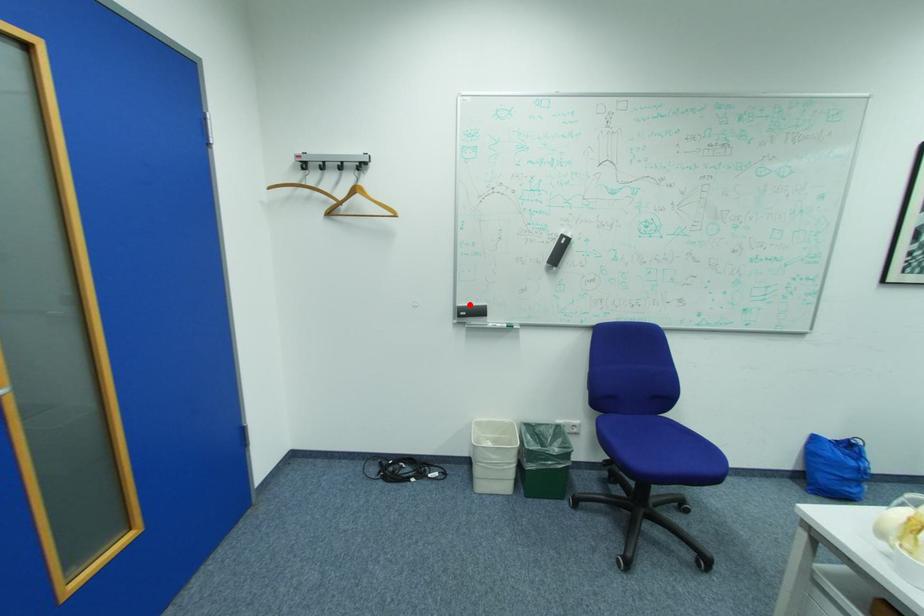
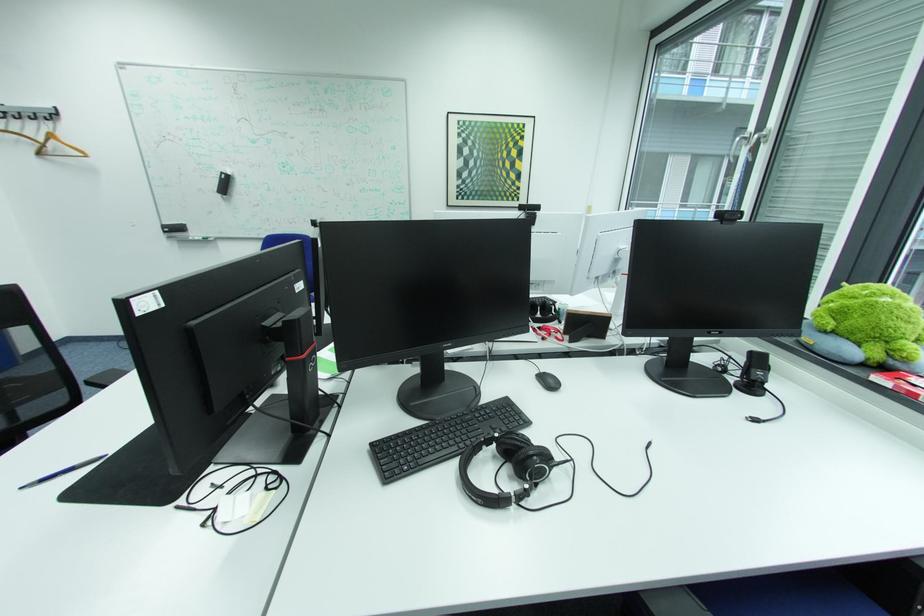
In the second image, find the point that corresponds to the highlighted location in the first image.

(175, 223)